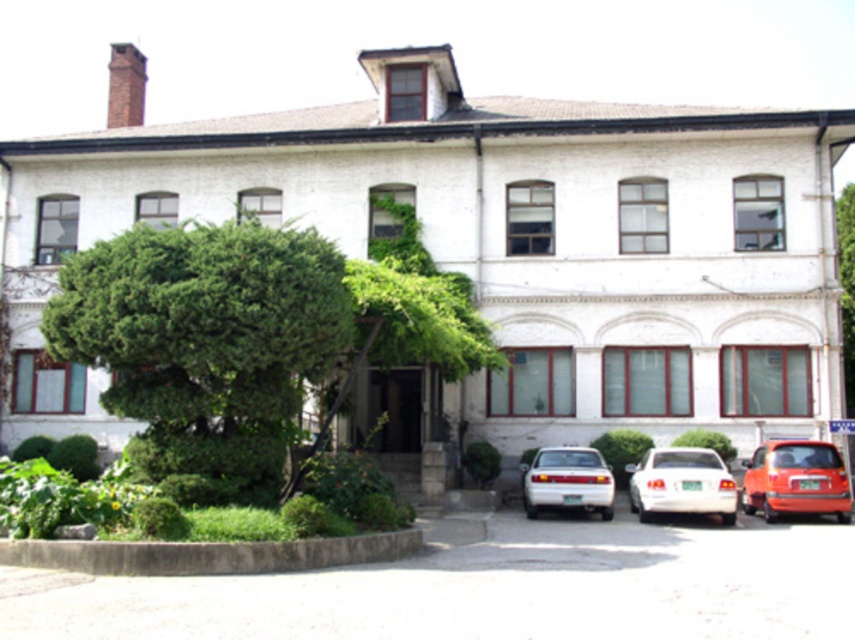
Question: Which of these objects is positioned closest to the green leafy tree at left?

Choices:
 (A) white glossy sedan at lower right
 (B) shiny orange car at lower right

Answer: (A)

Question: Is green leafy tree at left bigger than white glossy sedan at lower right?

Choices:
 (A) no
 (B) yes

Answer: (A)

Question: Does green leafy tree at left have a greater width compared to shiny orange car at lower right?

Choices:
 (A) no
 (B) yes

Answer: (A)

Question: Among these objects, which one is nearest to the camera?

Choices:
 (A) white glossy sedan at lower right
 (B) green leafy tree at center
 (C) white matte sedan at center
 (D) green leafy tree at left

Answer: (D)

Question: Which point is closer to the camera taking this photo?

Choices:
 (A) (585, 496)
 (B) (335, 316)

Answer: (B)

Question: Is white glossy sedan at lower right to the left of white matte sedan at center from the viewer's perspective?

Choices:
 (A) no
 (B) yes

Answer: (A)